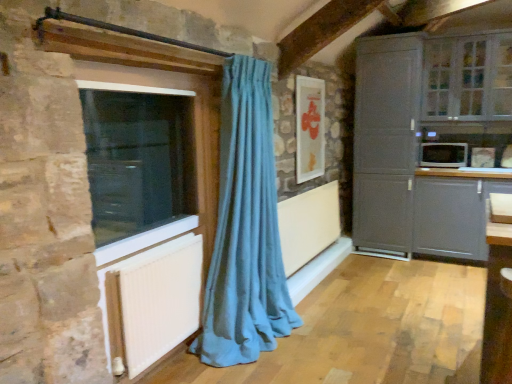
Question: Considering the relative sizes of transparent glass window at left, the 2th window viewed from the top, and white glossy microwave at right in the image provided, is transparent glass window at left, the 2th window viewed from the top, thinner than white glossy microwave at right?

Choices:
 (A) yes
 (B) no

Answer: (A)

Question: Can you confirm if transparent glass window at left, positioned as the first window in front-to-back order, is taller than white glossy microwave at right?

Choices:
 (A) yes
 (B) no

Answer: (A)

Question: Does transparent glass window at left, the 2th window viewed from the top, have a lesser height compared to white glossy microwave at right?

Choices:
 (A) no
 (B) yes

Answer: (A)

Question: Can you confirm if transparent glass window at left, positioned as the first window in left-to-right order, is positioned to the right of white glossy microwave at right?

Choices:
 (A) yes
 (B) no

Answer: (B)

Question: From the image's perspective, is transparent glass window at left, positioned as the first window in left-to-right order, below white glossy microwave at right?

Choices:
 (A) no
 (B) yes

Answer: (B)

Question: Which is correct: matte gray cabinet at right is inside matte gray cabinet at lower right, or outside of it?

Choices:
 (A) outside
 (B) inside

Answer: (A)

Question: In terms of size, does matte gray cabinet at right appear bigger or smaller than matte gray cabinet at lower right?

Choices:
 (A) small
 (B) big

Answer: (B)

Question: From the image's perspective, is matte gray cabinet at right located above or below matte gray cabinet at lower right?

Choices:
 (A) above
 (B) below

Answer: (A)

Question: In terms of width, does matte gray cabinet at right look wider or thinner when compared to matte gray cabinet at lower right?

Choices:
 (A) thin
 (B) wide

Answer: (B)

Question: From the image's perspective, is matte gray cabinet at lower right located above or below matte gray cabinet at right?

Choices:
 (A) above
 (B) below

Answer: (B)

Question: In terms of width, does matte gray cabinet at lower right look wider or thinner when compared to matte gray cabinet at right?

Choices:
 (A) thin
 (B) wide

Answer: (A)

Question: Considering their positions, is matte gray cabinet at lower right located in front of or behind matte gray cabinet at right?

Choices:
 (A) front
 (B) behind

Answer: (A)

Question: Visually, is matte gray cabinet at lower right positioned to the left or to the right of matte gray cabinet at right?

Choices:
 (A) left
 (B) right

Answer: (B)

Question: From a real-world perspective, is matte gray cabinet at right above or below white textured radiator at lower left?

Choices:
 (A) above
 (B) below

Answer: (A)

Question: Is matte gray cabinet at right situated inside white textured radiator at lower left or outside?

Choices:
 (A) inside
 (B) outside

Answer: (B)